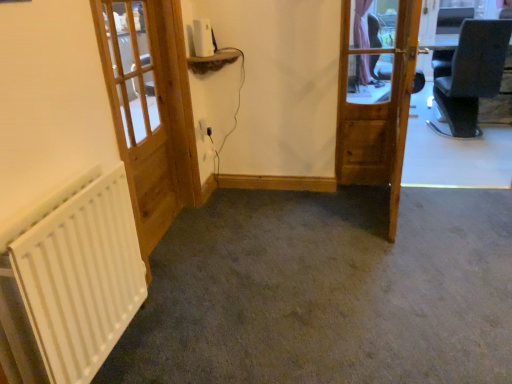
Question: From a real-world perspective, is white matte radiator at lower left on wooden door at center, acting as the second door starting from the left?

Choices:
 (A) yes
 (B) no

Answer: (B)

Question: From the image's perspective, does white matte radiator at lower left appear higher than wooden door at center, the first door from the right?

Choices:
 (A) yes
 (B) no

Answer: (B)

Question: Can you confirm if white matte radiator at lower left is smaller than wooden door at center, the first door from the right?

Choices:
 (A) no
 (B) yes

Answer: (B)

Question: Is white matte radiator at lower left turned away from wooden door at center, the first door from the right?

Choices:
 (A) no
 (B) yes

Answer: (A)

Question: Does white matte radiator at lower left have a greater height compared to wooden door at center, the first door from the right?

Choices:
 (A) no
 (B) yes

Answer: (A)

Question: From a real-world perspective, is wooden door at center, acting as the second door starting from the left, physically located above or below white wooden door at left, marked as the second door in a right-to-left arrangement?

Choices:
 (A) above
 (B) below

Answer: (B)

Question: In the image, is wooden door at center, acting as the second door starting from the left, on the left side or the right side of white wooden door at left, marked as the second door in a right-to-left arrangement?

Choices:
 (A) right
 (B) left

Answer: (A)

Question: Looking at the image, does wooden door at center, acting as the second door starting from the left, seem bigger or smaller compared to white wooden door at left, marked as the second door in a right-to-left arrangement?

Choices:
 (A) big
 (B) small

Answer: (B)

Question: Relative to white wooden door at left, which is the first door in left-to-right order, is wooden door at center, acting as the second door starting from the left, in front or behind?

Choices:
 (A) front
 (B) behind

Answer: (B)

Question: Is point (119, 84) positioned closer to the camera than point (199, 124)?

Choices:
 (A) closer
 (B) farther

Answer: (A)

Question: In terms of size, does white wooden door at left, which is the first door in left-to-right order, appear bigger or smaller than white plastic electric outlet at center?

Choices:
 (A) small
 (B) big

Answer: (B)

Question: From the image's perspective, is white wooden door at left, which is the first door in left-to-right order, positioned above or below white plastic electric outlet at center?

Choices:
 (A) above
 (B) below

Answer: (B)

Question: Is white wooden door at left, marked as the second door in a right-to-left arrangement, taller or shorter than white plastic electric outlet at center?

Choices:
 (A) short
 (B) tall

Answer: (B)

Question: Is white matte radiator at lower left in front of or behind white plastic electric outlet at center in the image?

Choices:
 (A) behind
 (B) front

Answer: (B)

Question: From the image's perspective, is white matte radiator at lower left positioned above or below white plastic electric outlet at center?

Choices:
 (A) above
 (B) below

Answer: (B)